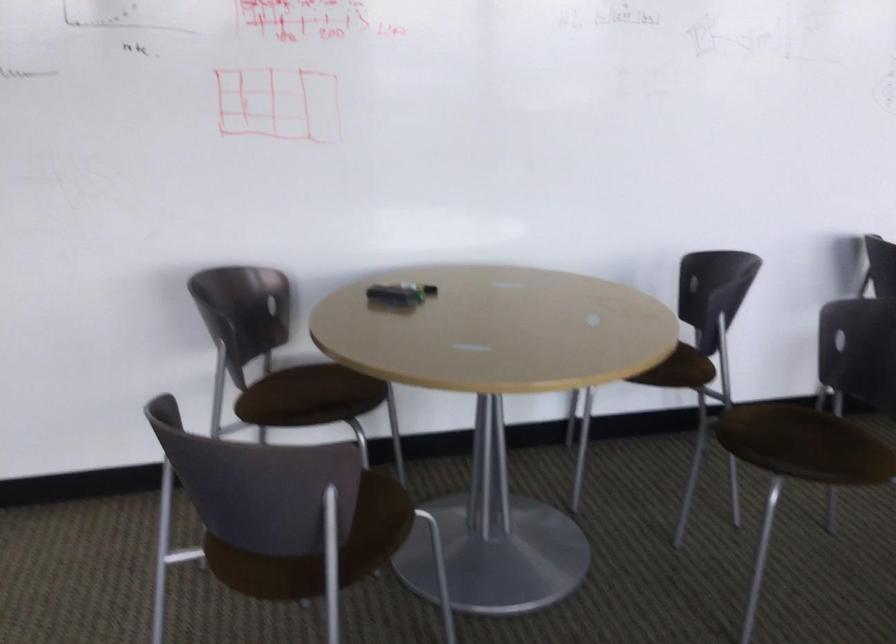
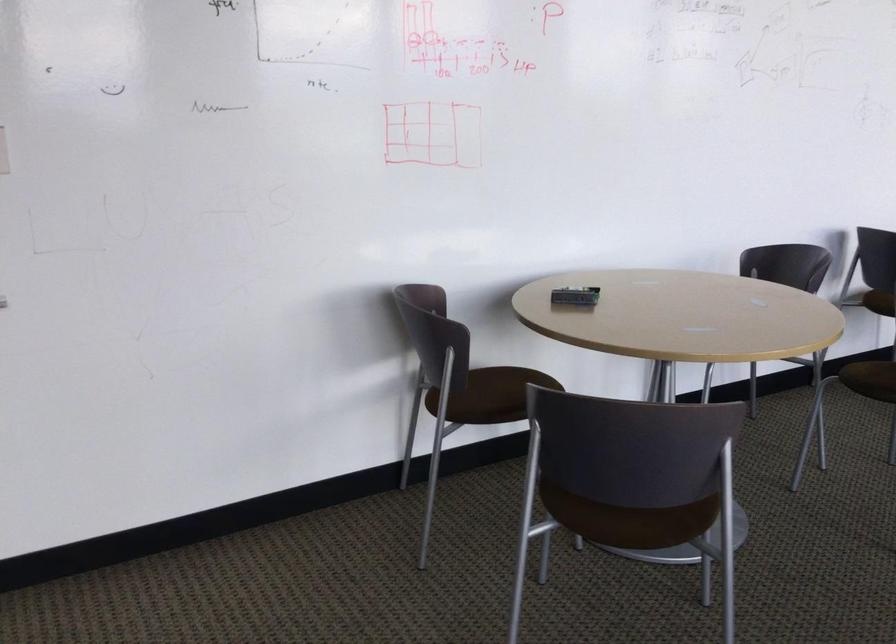
Locate, in the second image, the point that corresponds to the point at 272,542 in the first image.

(633, 505)